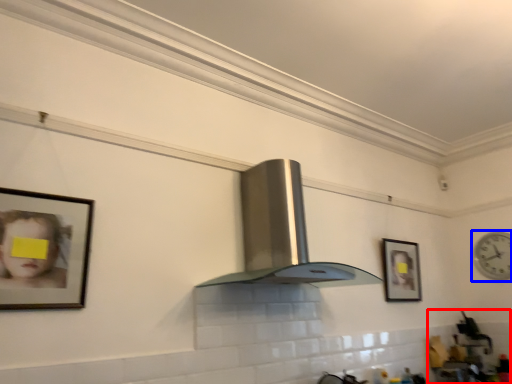
Question: Among these objects, which one is nearest to the camera, sink (highlighted by a red box) or clock (highlighted by a blue box)?

Choices:
 (A) sink
 (B) clock

Answer: (A)